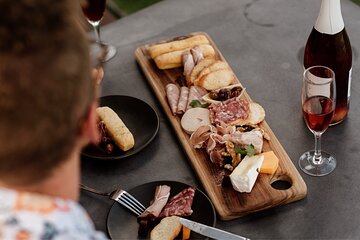
At what (x,y) coordinates should I click in order to perform the action: click on gray countertop. Please return your answer as a coordinate pair (x, y). The width and height of the screenshot is (360, 240). Looking at the image, I should click on [249, 47].